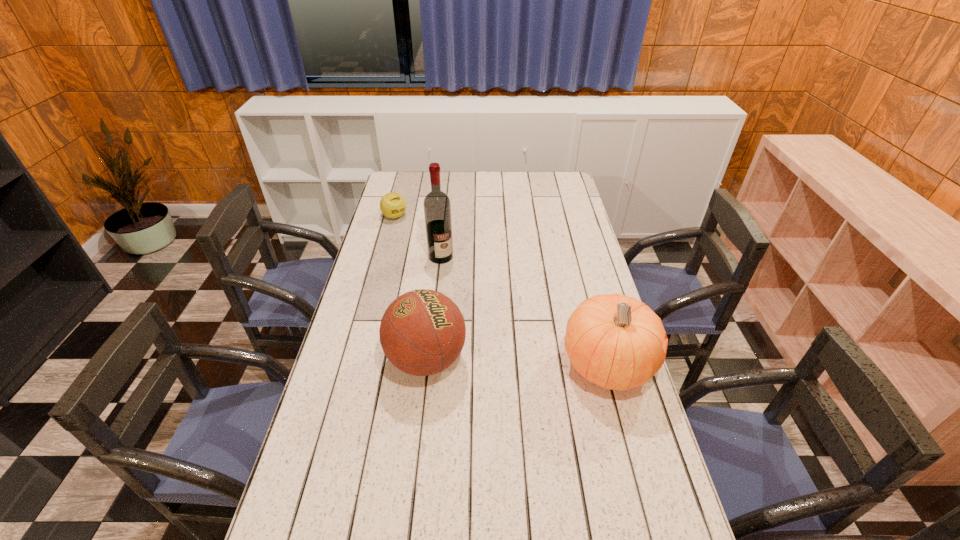
Point out which object is positioned as the third nearest to the rightmost object. Please provide its 2D coordinates. Your answer should be formatted as a tuple, i.e. [(x, y)], where the tuple contains the x and y coordinates of a point satisfying the conditions above.

[(393, 205)]

You are a GUI agent. You are given a task and a screenshot of the screen. Output one action in this format:
    pyautogui.click(x=<x>, y=<y>)
    Task: Click on the free space that satisfies the following two spatial constraints: 1. on the front side of the softball; 2. on the front-facing side of the rightmost object
    This screenshot has width=960, height=540.
    Given the screenshot: What is the action you would take?
    pyautogui.click(x=355, y=365)

Locate an element on the screen. Image resolution: width=960 pixels, height=540 pixels. vacant area that satisfies the following two spatial constraints: 1. on the front side of the shortest object; 2. on the front-facing side of the rightmost object is located at coordinates (355, 365).

Where is `free spot that satisfies the following two spatial constraints: 1. on the front side of the pumpkin; 2. on the front-facing side of the basketball`? This screenshot has height=540, width=960. free spot that satisfies the following two spatial constraints: 1. on the front side of the pumpkin; 2. on the front-facing side of the basketball is located at coordinates (425, 365).

Find the location of a particular element. This screenshot has height=540, width=960. vacant space that satisfies the following two spatial constraints: 1. on the front side of the shortest object; 2. on the left side of the basketball is located at coordinates (357, 360).

Locate an element on the screen. vacant space that satisfies the following two spatial constraints: 1. on the front side of the basketball; 2. on the front-facing side of the rightmost object is located at coordinates (425, 365).